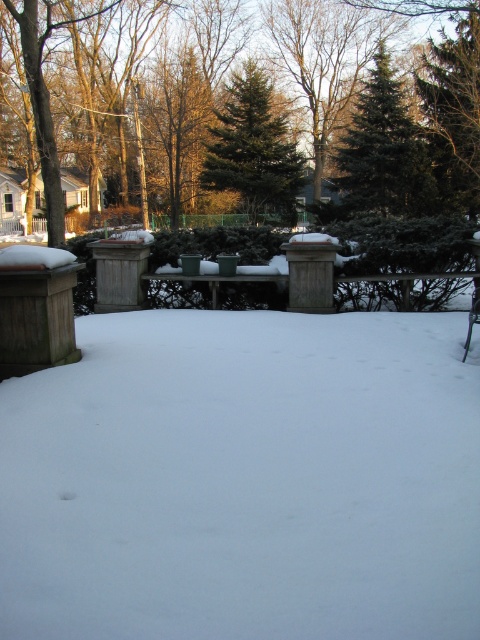
Question: Does white fluffy snow at center have a lesser width compared to green textured evergreen tree at center?

Choices:
 (A) no
 (B) yes

Answer: (B)

Question: Is green evergreen tree at center bigger than green fir tree at upper center?

Choices:
 (A) yes
 (B) no

Answer: (A)

Question: Among these objects, which one is nearest to the camera?

Choices:
 (A) green fir tree at upper center
 (B) green textured evergreen tree at center
 (C) green evergreen tree at center
 (D) white fluffy snow at center

Answer: (D)

Question: Is green evergreen tree at center behind green textured evergreen tree at center?

Choices:
 (A) yes
 (B) no

Answer: (B)

Question: Estimate the real-world distances between objects in this image. Which object is closer to the white fluffy snow at center?

Choices:
 (A) green fir tree at upper center
 (B) green textured evergreen tree at center
 (C) green evergreen tree at center

Answer: (A)

Question: Estimate the real-world distances between objects in this image. Which object is farther from the green evergreen tree at center?

Choices:
 (A) green textured evergreen tree at center
 (B) green fir tree at upper center
 (C) white fluffy snow at center

Answer: (C)